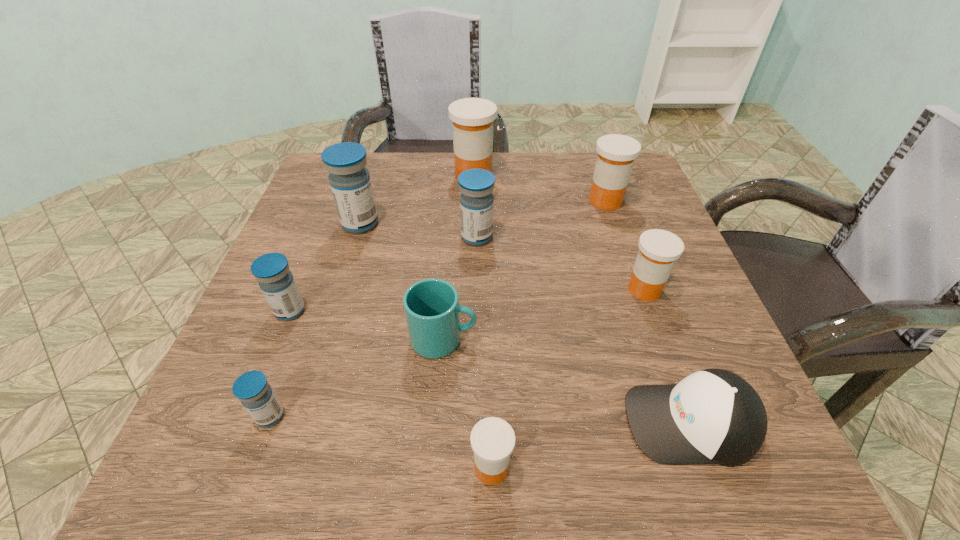
The image size is (960, 540). In order to click on vacant area located 0.170m on the label of the nearest medicine in this screenshot , I will do 350,468.

Where is `cap that is positioned at the near edge`? Image resolution: width=960 pixels, height=540 pixels. cap that is positioned at the near edge is located at coordinates (713, 416).

The height and width of the screenshot is (540, 960). Identify the location of cap at the right edge. point(713,416).

Locate an element on the screen. object located in the near left corner section of the desktop is located at coordinates (252, 389).

You are a GUI agent. You are given a task and a screenshot of the screen. Output one action in this format:
    pyautogui.click(x=<x>, y=<y>)
    Task: Click on the object that is positioned at the far right corner
    The height and width of the screenshot is (540, 960).
    Given the screenshot: What is the action you would take?
    pyautogui.click(x=616, y=153)

Where is `object that is at the near right corner`? This screenshot has height=540, width=960. object that is at the near right corner is located at coordinates (713, 416).

The height and width of the screenshot is (540, 960). In the image, there is a desktop. Find the location of `vacant space at the far edge`. vacant space at the far edge is located at coordinates (508, 157).

The height and width of the screenshot is (540, 960). Identify the location of vacant point at the near edge. (448, 443).

The height and width of the screenshot is (540, 960). In the image, there is a desktop. In order to click on free space at the left edge in this screenshot , I will do `click(301, 231)`.

The width and height of the screenshot is (960, 540). Find the location of `free space at the right edge of the desktop`. free space at the right edge of the desktop is located at coordinates (675, 285).